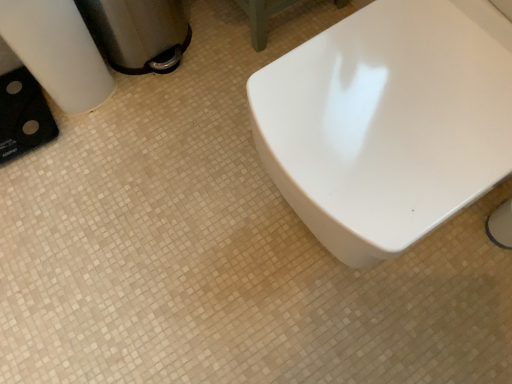
What do you see at coordinates (388, 122) in the screenshot?
I see `white glossy toilet at center` at bounding box center [388, 122].

The image size is (512, 384). I want to click on white glossy toilet at center, so click(x=388, y=122).

At what (x,y) coordinates should I click in order to perform the action: click on white glossy toilet at center. Please return your answer as a coordinate pair (x, y). This screenshot has width=512, height=384. Looking at the image, I should click on (388, 122).